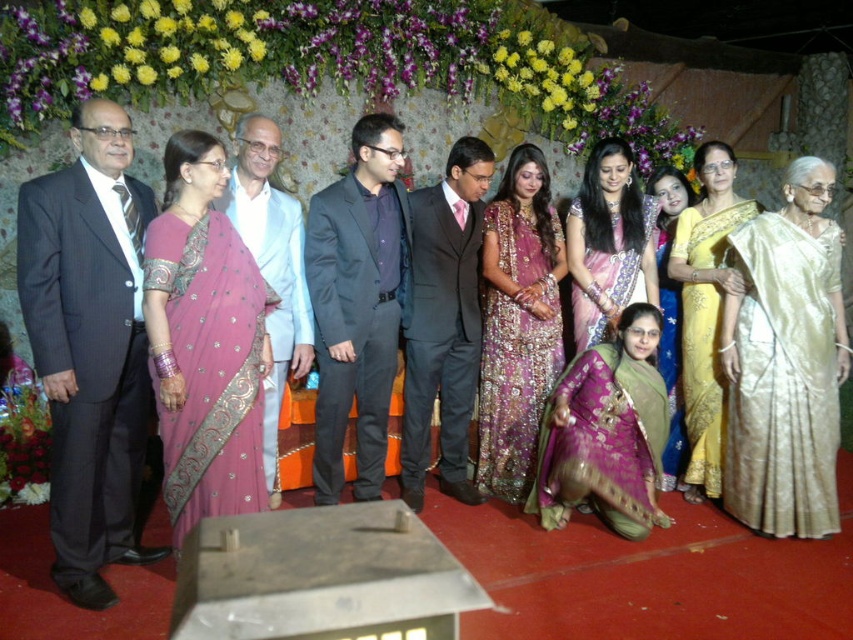
Between point (239, 394) and point (642, 520), which one is positioned behind?

The point (642, 520) is more distant.

Who is positioned more to the right, pink silk saree at center or purple brocade saree at center?

purple brocade saree at center

Which is behind, point (154, 355) or point (599, 362)?

The point (599, 362) is more distant.

The image size is (853, 640). What are the coordinates of `pink silk saree at center` in the screenshot? It's located at (204, 340).

Between dark gray pinstripe suit at left and pink silk saree at center, which one is positioned lower?

dark gray pinstripe suit at left is below.

Describe the element at coordinates (90, 346) in the screenshot. I see `dark gray pinstripe suit at left` at that location.

Locate an element on the screen. Image resolution: width=853 pixels, height=640 pixels. dark gray pinstripe suit at left is located at coordinates tap(90, 346).

Is dark gray suit at center bigger than purple satin saree at center?

Actually, dark gray suit at center might be smaller than purple satin saree at center.

Is dark gray suit at center below purple satin saree at center?

Indeed, dark gray suit at center is positioned under purple satin saree at center.

Is point (318, 310) less distant than point (665, 465)?

Yes, point (318, 310) is in front of point (665, 465).

Find the location of a particular element. The height and width of the screenshot is (640, 853). dark gray suit at center is located at coordinates (357, 304).